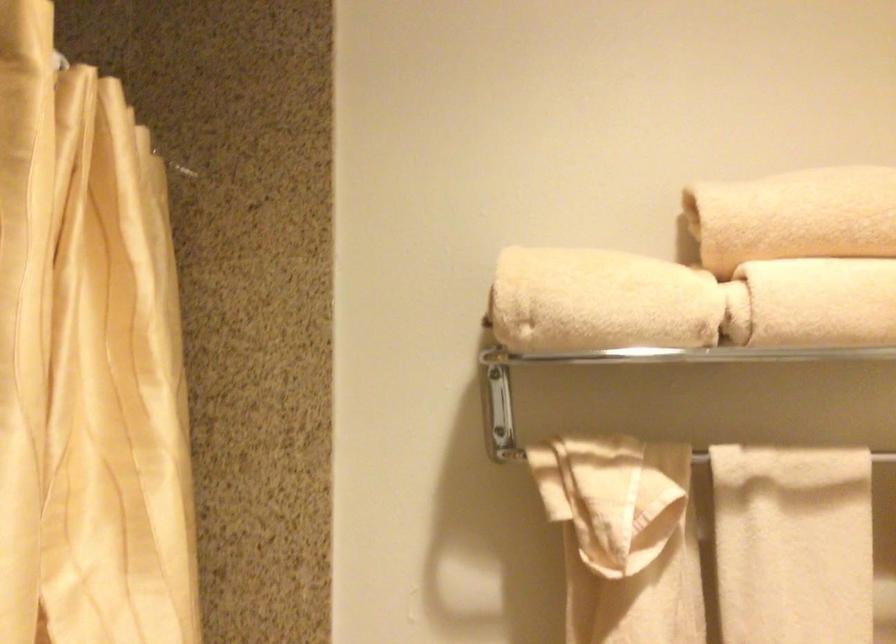
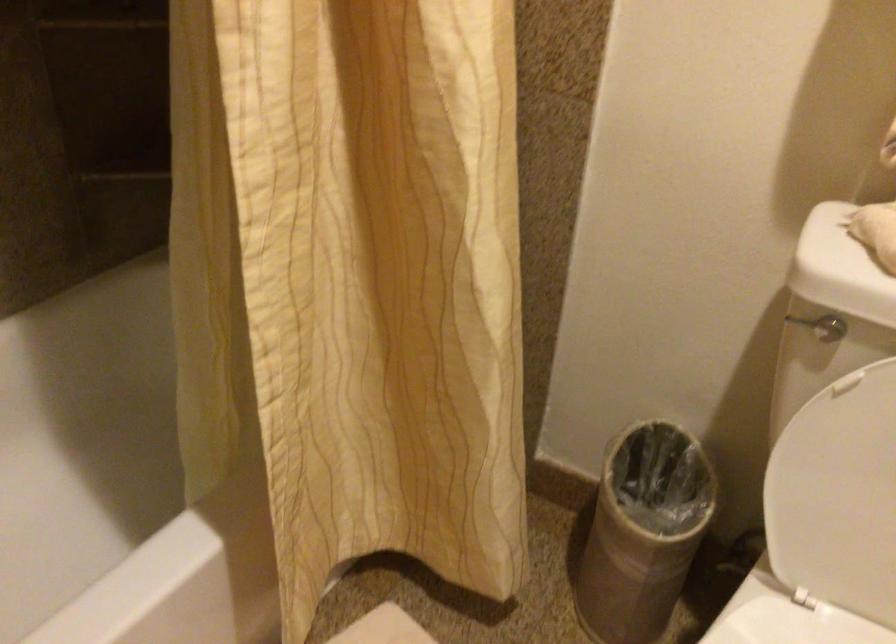
The images are taken continuously from a first-person perspective. In which direction is your viewpoint rotating?

The rotation direction of the camera is left-down.